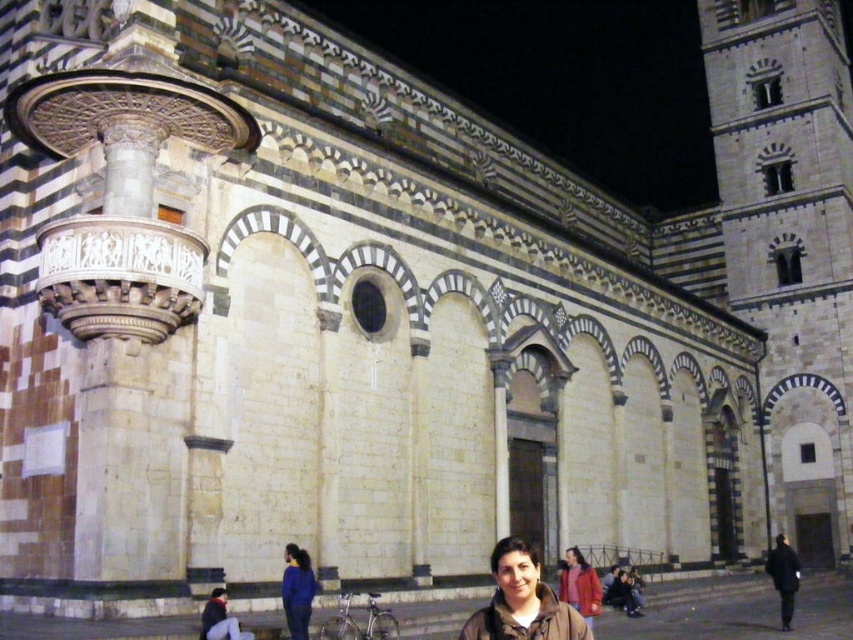
Can you confirm if matte brown jacket at lower center is shorter than blue fabric jacket at lower center?

No.

Does matte brown jacket at lower center have a lesser width compared to blue fabric jacket at lower center?

In fact, matte brown jacket at lower center might be wider than blue fabric jacket at lower center.

Is point (531, 573) positioned before point (291, 584)?

Yes, point (531, 573) is in front of point (291, 584).

This screenshot has height=640, width=853. I want to click on matte brown jacket at lower center, so click(521, 602).

Does gray stone tower at right have a greater height compared to red woolen coat at lower center?

Yes, gray stone tower at right is taller than red woolen coat at lower center.

Can you confirm if gray stone tower at right is positioned to the left of red woolen coat at lower center?

No, gray stone tower at right is not to the left of red woolen coat at lower center.

Where is `gray stone tower at right`? Image resolution: width=853 pixels, height=640 pixels. gray stone tower at right is located at coordinates (790, 244).

This screenshot has width=853, height=640. I want to click on gray stone tower at right, so click(x=790, y=244).

Which is in front, point (728, 134) or point (300, 564)?

Positioned in front is point (300, 564).

Can you confirm if gray stone tower at right is thinner than blue fabric jacket at lower center?

No, gray stone tower at right is not thinner than blue fabric jacket at lower center.

Which is in front, point (828, 429) or point (288, 552)?

Positioned in front is point (288, 552).

You are a GUI agent. You are given a task and a screenshot of the screen. Output one action in this format:
    pyautogui.click(x=<x>, y=<y>)
    Task: Click on the gray stone tower at right
    
    Given the screenshot: What is the action you would take?
    pyautogui.click(x=790, y=244)